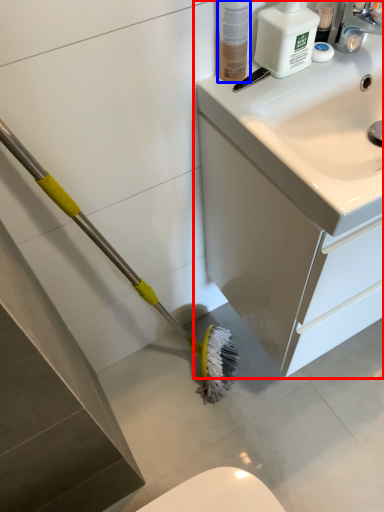
Question: Which of the following is the farthest to the observer, bathroom cabinet (highlighted by a red box) or toiletry (highlighted by a blue box)?

Choices:
 (A) bathroom cabinet
 (B) toiletry

Answer: (A)